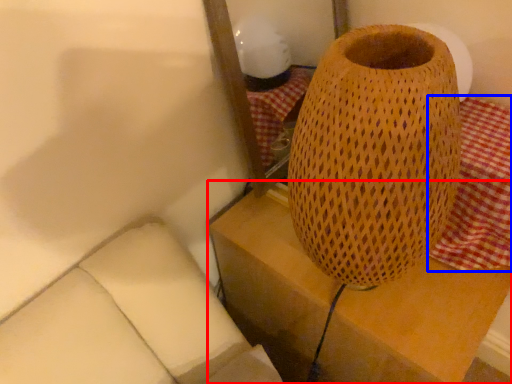
Question: Among these objects, which one is farthest to the camera, furniture (highlighted by a red box) or tablecloth (highlighted by a blue box)?

Choices:
 (A) furniture
 (B) tablecloth

Answer: (A)